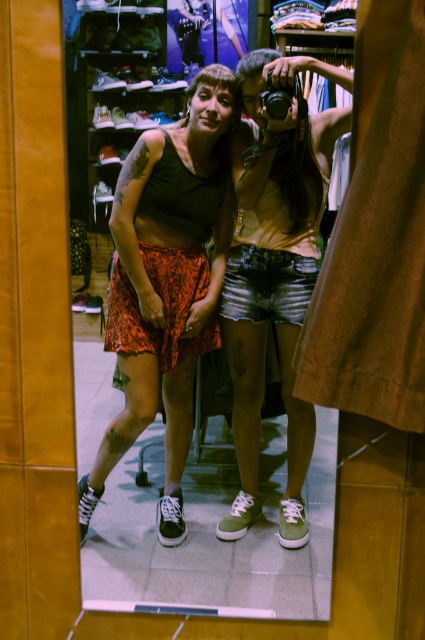
Question: Where is matte black tank top at center located in relation to black plastic camera at upper center in the image?

Choices:
 (A) below
 (B) above

Answer: (A)

Question: Which object is the closest to the denim shorts at center?

Choices:
 (A) matte black tank top at center
 (B) black plastic camera at upper center

Answer: (A)

Question: Among these objects, which one is farthest from the camera?

Choices:
 (A) black plastic camera at upper center
 (B) matte black tank top at center
 (C) denim shorts at center

Answer: (B)

Question: Among these objects, which one is farthest from the camera?

Choices:
 (A) black plastic camera at upper center
 (B) denim shorts at center

Answer: (A)

Question: Where is matte black tank top at center located in relation to denim shorts at center in the image?

Choices:
 (A) left
 (B) right

Answer: (A)

Question: Does denim shorts at center come behind black plastic camera at upper center?

Choices:
 (A) no
 (B) yes

Answer: (A)